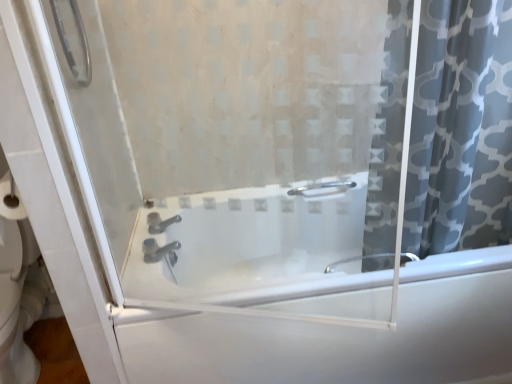
Question: Looking at their shapes, would you say satin nickel faucet at center is wider or thinner than white glossy bathtub at center?

Choices:
 (A) wide
 (B) thin

Answer: (B)

Question: From the image's perspective, is satin nickel faucet at center positioned above or below white glossy bathtub at center?

Choices:
 (A) below
 (B) above

Answer: (B)

Question: Estimate the real-world distances between objects in this image. Which object is farther from the white glossy bathtub at center?

Choices:
 (A) gray patterned fabric at right
 (B) satin nickel faucet at center

Answer: (B)

Question: Which of these objects is positioned farthest from the white glossy bathtub at center?

Choices:
 (A) satin nickel faucet at center
 (B) gray patterned fabric at right

Answer: (A)